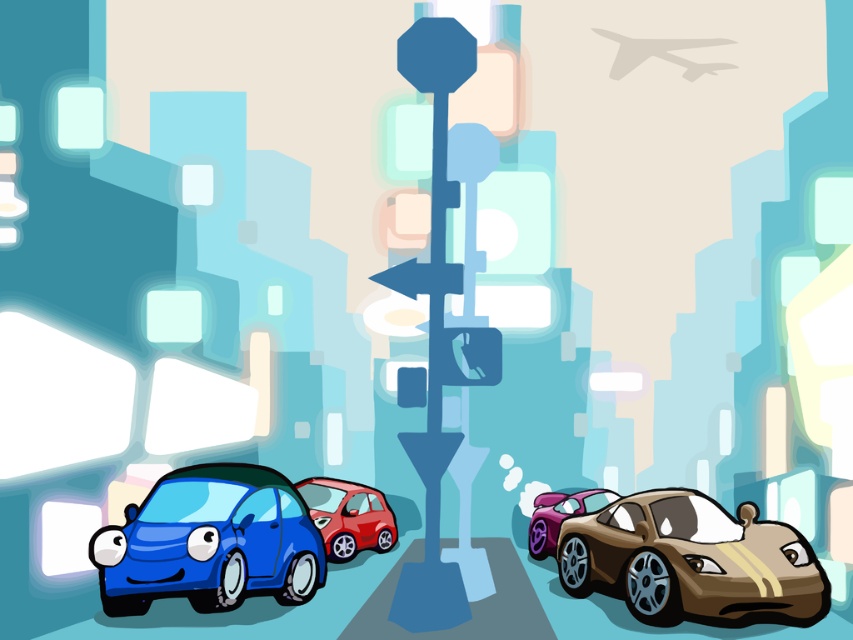
Question: Among these objects, which one is farthest from the camera?

Choices:
 (A) glossy plastic car at lower left
 (B) purple metallic sports car at right
 (C) glossy red car at center

Answer: (B)

Question: Which of the following is the closest to the observer?

Choices:
 (A) glossy red car at center
 (B) purple metallic sports car at right
 (C) shiny gold sports car at lower right
 (D) glossy plastic car at lower left

Answer: (D)

Question: From the image, what is the correct spatial relationship of shiny gold sports car at lower right in relation to glossy plastic car at lower left?

Choices:
 (A) left
 (B) right

Answer: (B)

Question: Can you confirm if shiny gold sports car at lower right is smaller than glossy red car at center?

Choices:
 (A) yes
 (B) no

Answer: (B)

Question: Does glossy red car at center have a greater width compared to purple metallic sports car at right?

Choices:
 (A) yes
 (B) no

Answer: (A)

Question: Which of the following is the closest to the observer?

Choices:
 (A) (350, 536)
 (B) (189, 467)
 (C) (582, 525)
 (D) (608, 499)

Answer: (B)